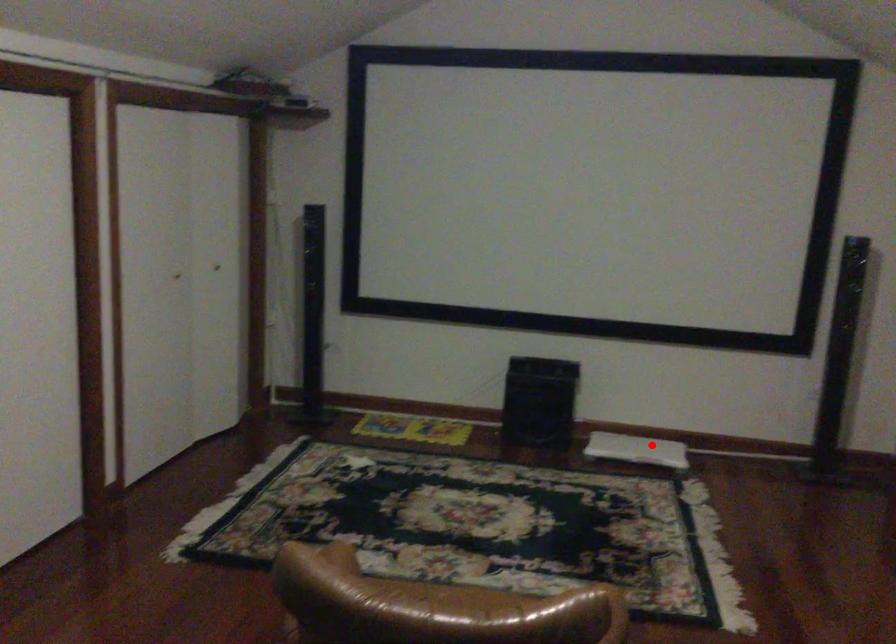
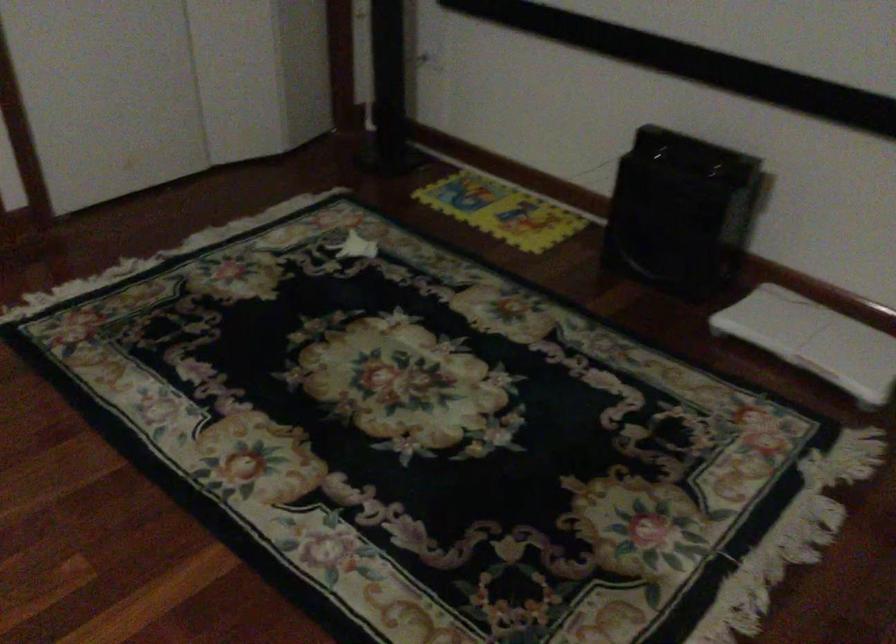
Question: I am providing you with two images of the same scene from different viewpoints. Given a red point in image1, look at the same physical point in image2. Is it:

Choices:
 (A) Closer to the viewpoint
 (B) Farther from the viewpoint

Answer: (A)